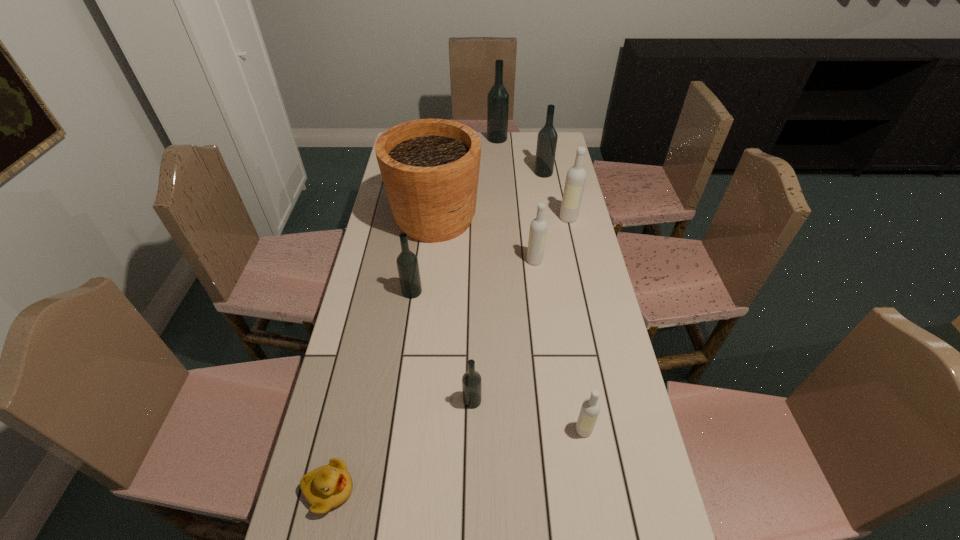
You are a GUI agent. You are given a task and a screenshot of the screen. Output one action in this format:
    pyautogui.click(x=<x>, y=<y>)
    Task: Click on the vacant point located 0.180m on the back of the third farthest vodka
    The width and height of the screenshot is (960, 540).
    Given the screenshot: What is the action you would take?
    pyautogui.click(x=562, y=186)

Find the location of a particular element. Image resolution: width=960 pixels, height=540 pixels. vacant space located on the front of the second biggest white vodka is located at coordinates (540, 297).

At what (x,y) coordinates should I click in order to perform the action: click on free region located 0.400m on the front of the leftmost black vodka. Please return your answer as a coordinate pair (x, y). Looking at the image, I should click on (394, 416).

Identify the location of free space located 0.050m on the right of the second nearest object. The width and height of the screenshot is (960, 540). (612, 430).

Locate an element on the screen. vacant point located on the front of the sixth farthest vodka is located at coordinates (470, 509).

Where is `free location located on the front-facing side of the shortest object`? free location located on the front-facing side of the shortest object is located at coordinates (437, 490).

Find the location of `object at the far edge`. object at the far edge is located at coordinates (498, 97).

Where is `flowerpot at the left edge`? This screenshot has height=540, width=960. flowerpot at the left edge is located at coordinates (430, 168).

Where is `vodka that is at the left edge`? The image size is (960, 540). vodka that is at the left edge is located at coordinates click(x=407, y=262).

Find the location of a particular element. duckling located in the left edge section of the desktop is located at coordinates (326, 487).